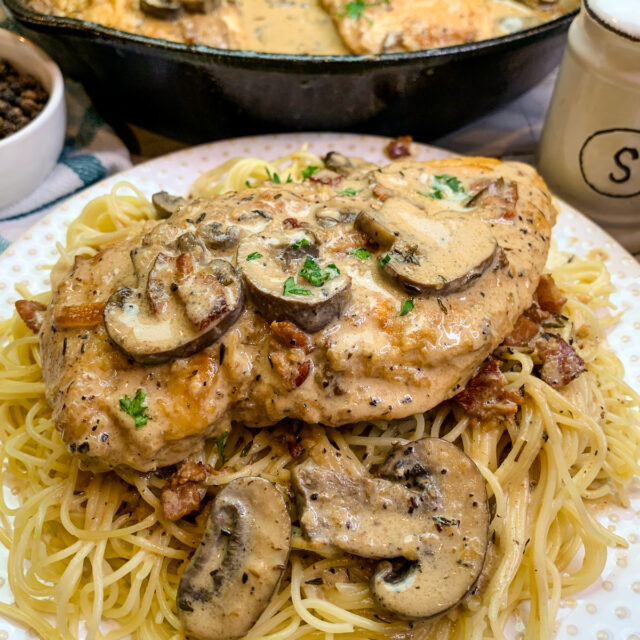
This screenshot has height=640, width=640. I want to click on tablecloth, so click(x=502, y=132).